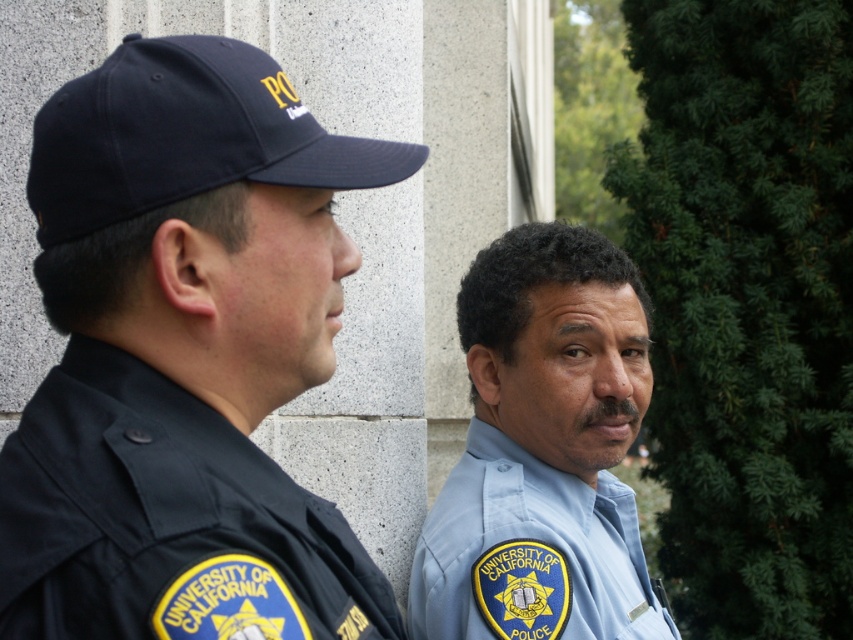
You are a drone operator trying to fly a drone between two points in the image. The first point is point (x=61, y=196) and the second point is point (x=527, y=474). According to the scene description, which point is closer to the drone operator?

Point (x=61, y=196) is in front of point (x=527, y=474), so the drone operator is closer to point (x=61, y=196).

You are a photographer trying to capture a clear shot of the light blue uniform at center. Based on its position, which direction should you move to ensure it fills the frame better?

The light blue uniform at center is located at point (543, 451), so moving towards the lower right direction would position it better in the frame.